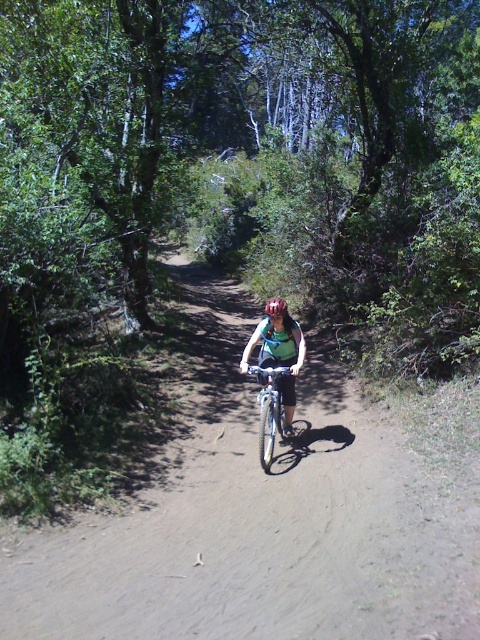
Measure the distance from silver metallic bicycle at center to matte black helmet at center.

The distance of silver metallic bicycle at center from matte black helmet at center is 1.27 meters.

Is point (276, 403) farther from camera compared to point (265, 308)?

No, it is in front of (265, 308).

You are a GUI agent. You are given a task and a screenshot of the screen. Output one action in this format:
    pyautogui.click(x=<x>, y=<y>)
    Task: Click on the silver metallic bicycle at center
    This screenshot has height=640, width=480.
    Given the screenshot: What is the action you would take?
    pyautogui.click(x=271, y=412)

Which is in front, point (289, 384) or point (272, 307)?

Positioned in front is point (272, 307).

Which is below, matte green shirt at center or matte black helmet at center?

matte green shirt at center is lower down.

Locate an element on the screen. matte green shirt at center is located at coordinates (278, 356).

Who is higher up, matte green shirt at center or silver metallic bicycle at center?

matte green shirt at center

Can you confirm if matte green shirt at center is wider than silver metallic bicycle at center?

Correct, the width of matte green shirt at center exceeds that of silver metallic bicycle at center.

Find the location of a particular element. matte green shirt at center is located at coordinates (278, 356).

The image size is (480, 640). Find the location of `matte green shirt at center`. matte green shirt at center is located at coordinates (278, 356).